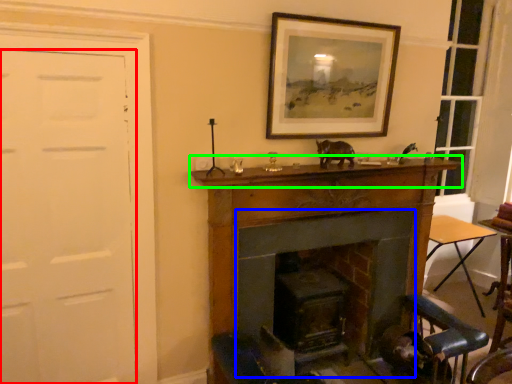
Question: Which object is the farthest from door (highlighted by a red box)? Choose among these: fireplace (highlighted by a blue box) or mantle (highlighted by a green box).

Choices:
 (A) fireplace
 (B) mantle

Answer: (A)